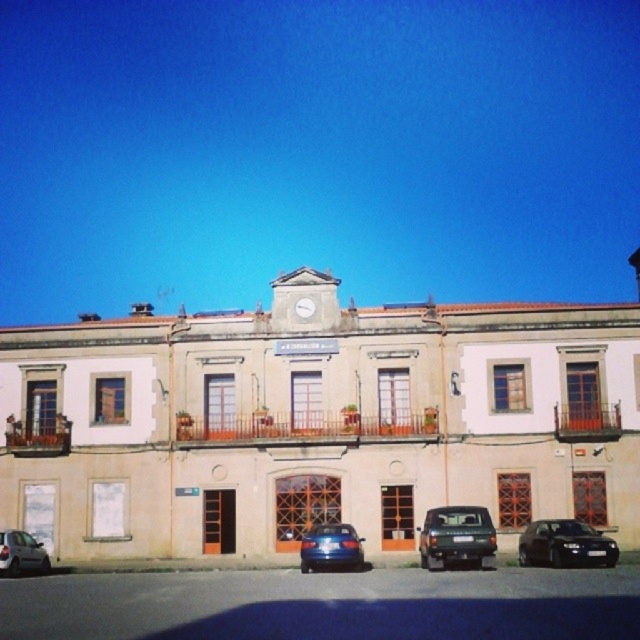
From the picture: Does black matte car at lower right have a larger size compared to white plastic clock at center?

Yes.

Between black matte car at lower right and white plastic clock at center, which one has less height?

With less height is white plastic clock at center.

Between point (536, 525) and point (298, 300), which one is positioned in front?

Point (536, 525) is in front.

Identify the location of black matte car at lower right. (564, 545).

Is shiny blue sedan at center shorter than metallic silver car at lower left?

Indeed, shiny blue sedan at center has a lesser height compared to metallic silver car at lower left.

Which is above, shiny blue sedan at center or metallic silver car at lower left?

shiny blue sedan at center

Who is more distant from viewer, (317, 532) or (6, 544)?

The point (6, 544) is more distant.

Where is `shiny blue sedan at center`? shiny blue sedan at center is located at coordinates [x=330, y=547].

Is point (467, 508) farther from camera compared to point (1, 554)?

Yes.

Which is more to the right, green matte car at lower center or metallic silver car at lower left?

From the viewer's perspective, green matte car at lower center appears more on the right side.

At what (x,y) coordinates should I click in order to perform the action: click on green matte car at lower center. Please return your answer as a coordinate pair (x, y). This screenshot has height=640, width=640. Looking at the image, I should click on (456, 536).